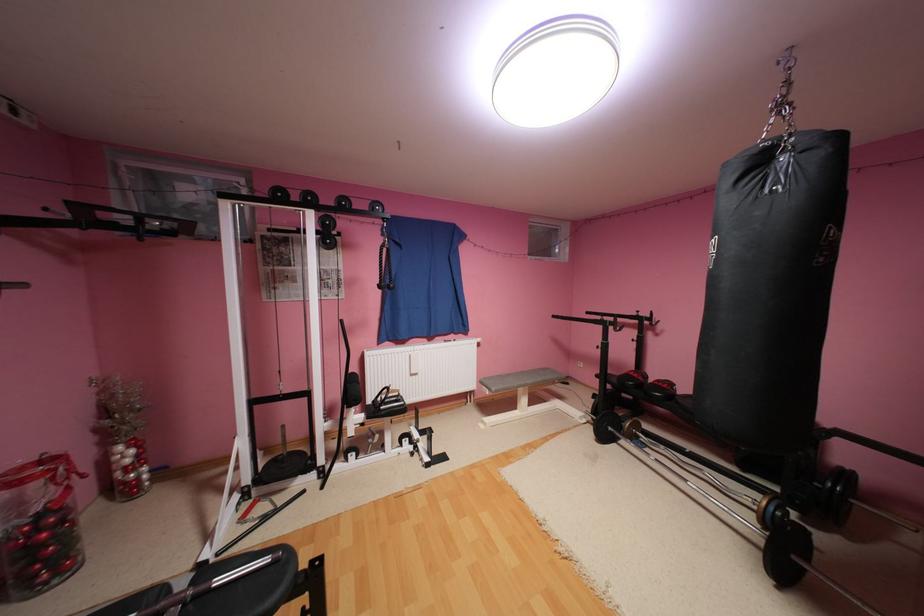
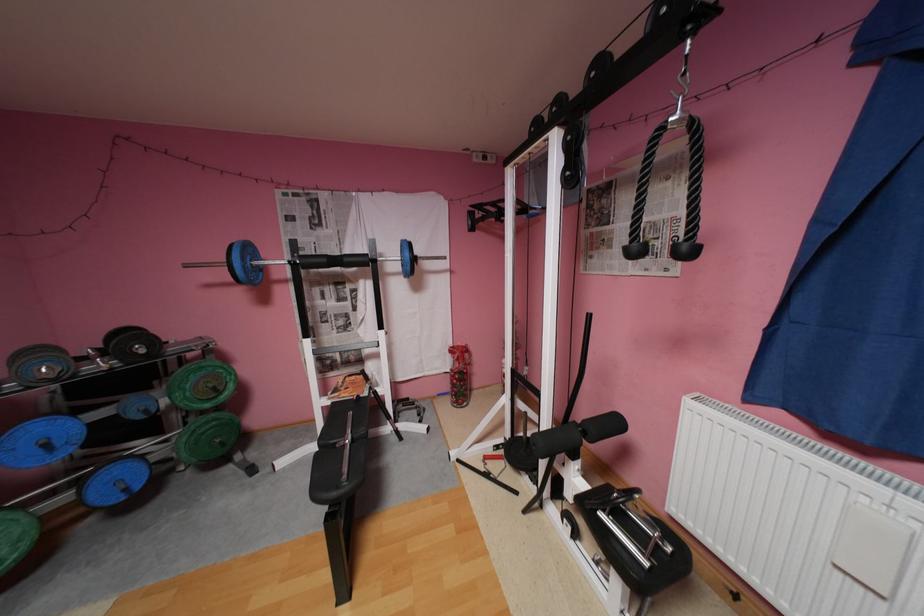
In the second image, find the point that corresponds to point (400, 285) in the first image.

(695, 246)